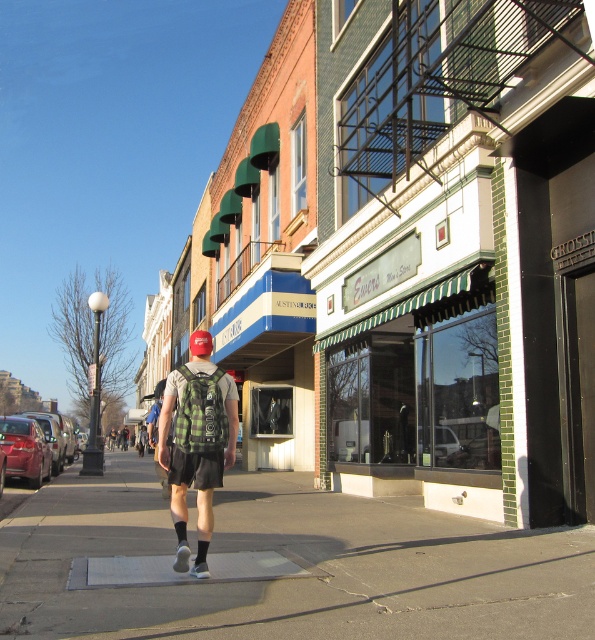
How much distance is there between gray concrete sidewalk at center and green plaid backpack at center?

gray concrete sidewalk at center is 13.06 feet from green plaid backpack at center.

Can you confirm if gray concrete sidewalk at center is smaller than green plaid backpack at center?

No.

Image resolution: width=595 pixels, height=640 pixels. What do you see at coordinates (283, 566) in the screenshot?
I see `gray concrete sidewalk at center` at bounding box center [283, 566].

I want to click on gray concrete sidewalk at center, so 283,566.